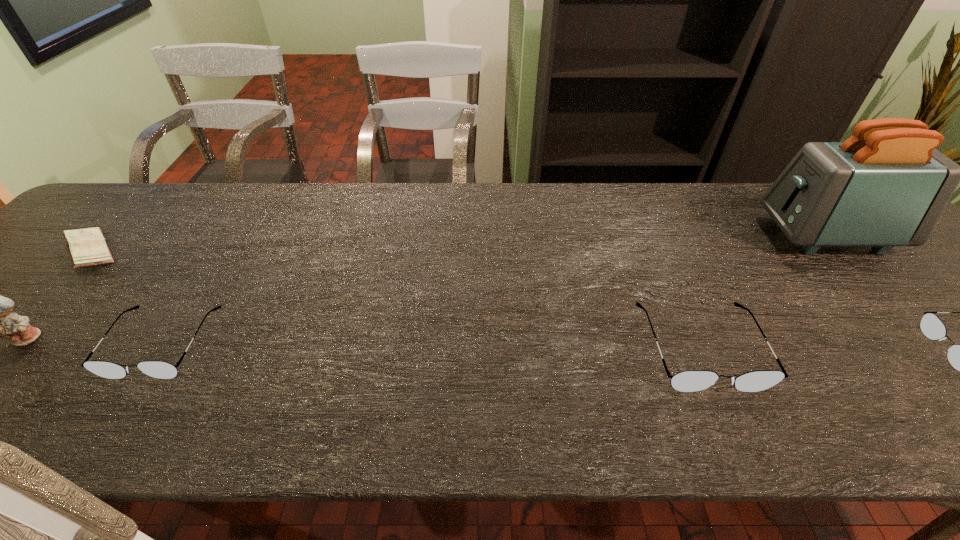
Where is `free space located on the front-facing side of the tallest object`? free space located on the front-facing side of the tallest object is located at coordinates click(681, 235).

Locate an element on the screen. This screenshot has width=960, height=540. diary at the far edge is located at coordinates point(87,247).

This screenshot has width=960, height=540. I want to click on toaster located in the far edge section of the desktop, so click(x=885, y=186).

Find the location of `diary that is at the left edge`. diary that is at the left edge is located at coordinates (87, 247).

Locate an element on the screen. This screenshot has width=960, height=540. teddy bear situated at the left edge is located at coordinates (0, 321).

Image resolution: width=960 pixels, height=540 pixels. In order to click on object that is at the right edge in this screenshot , I will do `click(885, 186)`.

This screenshot has width=960, height=540. Find the location of `object at the far left corner`. object at the far left corner is located at coordinates (87, 247).

The width and height of the screenshot is (960, 540). What are the coordinates of `object positioned at the far right corner` in the screenshot? It's located at (885, 186).

You are a GUI agent. You are given a task and a screenshot of the screen. Output one action in this format:
    pyautogui.click(x=<x>, y=<y>)
    Task: Click on the vacant region at the far edge of the desktop
    
    Given the screenshot: What is the action you would take?
    pyautogui.click(x=478, y=207)

Where is `vacant space at the near edge of the desktop`? vacant space at the near edge of the desktop is located at coordinates (590, 388).